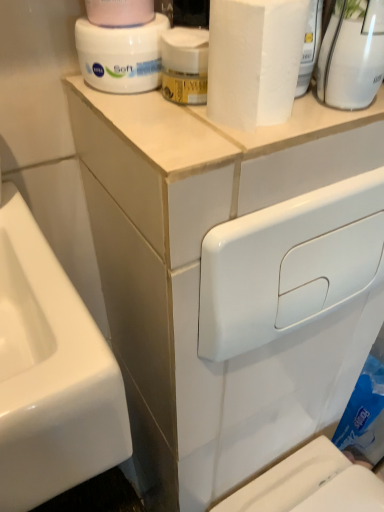
Question: From a real-world perspective, is white glossy toilet tank at upper center beneath pink matte toilet paper at upper center?

Choices:
 (A) no
 (B) yes

Answer: (B)

Question: Does white glossy toilet tank at upper center have a greater width compared to pink matte toilet paper at upper center?

Choices:
 (A) no
 (B) yes

Answer: (A)

Question: Is the depth of white glossy toilet tank at upper center less than that of pink matte toilet paper at upper center?

Choices:
 (A) yes
 (B) no

Answer: (B)

Question: Is white glossy toilet tank at upper center beside pink matte toilet paper at upper center?

Choices:
 (A) yes
 (B) no

Answer: (B)

Question: Is white glossy toilet tank at upper center bigger than pink matte toilet paper at upper center?

Choices:
 (A) no
 (B) yes

Answer: (B)

Question: Considering the positions of white matte jar at upper center, marked as the first cleaning product in a left-to-right arrangement, and white glossy toilet tank at upper center in the image, is white matte jar at upper center, marked as the first cleaning product in a left-to-right arrangement, taller or shorter than white glossy toilet tank at upper center?

Choices:
 (A) tall
 (B) short

Answer: (B)

Question: From the image's perspective, relative to white glossy toilet tank at upper center, is white matte jar at upper center, marked as the first cleaning product in a left-to-right arrangement, above or below?

Choices:
 (A) above
 (B) below

Answer: (A)

Question: Does point (82, 26) appear closer or farther from the camera than point (183, 322)?

Choices:
 (A) farther
 (B) closer

Answer: (B)

Question: Considering the positions of white matte jar at upper center, which ranks as the second cleaning product in right-to-left order, and white glossy toilet tank at upper center in the image, is white matte jar at upper center, which ranks as the second cleaning product in right-to-left order, wider or thinner than white glossy toilet tank at upper center?

Choices:
 (A) wide
 (B) thin

Answer: (A)

Question: Is point (253, 113) positioned closer to the camera than point (168, 291)?

Choices:
 (A) farther
 (B) closer

Answer: (B)

Question: In terms of size, does white matte paper towel at upper center appear bigger or smaller than white glossy toilet tank at upper center?

Choices:
 (A) small
 (B) big

Answer: (A)

Question: In the image, is white matte paper towel at upper center on the left side or the right side of white glossy toilet tank at upper center?

Choices:
 (A) left
 (B) right

Answer: (A)

Question: From the image's perspective, is white matte paper towel at upper center located above or below white glossy toilet tank at upper center?

Choices:
 (A) above
 (B) below

Answer: (A)

Question: Does point (87, 9) appear closer or farther from the camera than point (170, 480)?

Choices:
 (A) closer
 (B) farther

Answer: (A)

Question: Would you say pink matte toilet paper at upper center is to the left or to the right of white glossy toilet tank at upper center in the picture?

Choices:
 (A) left
 (B) right

Answer: (A)